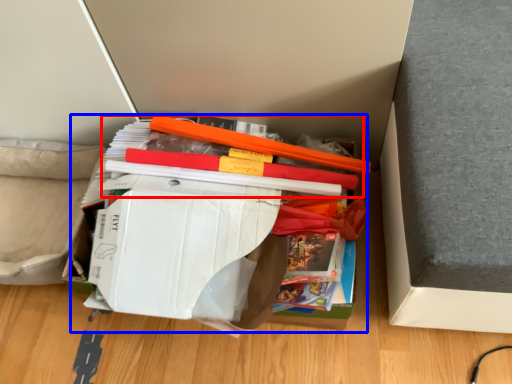
Question: Which object appears farthest to the camera in this image, book (highlighted by a red box) or paperback book (highlighted by a blue box)?

Choices:
 (A) book
 (B) paperback book

Answer: (A)